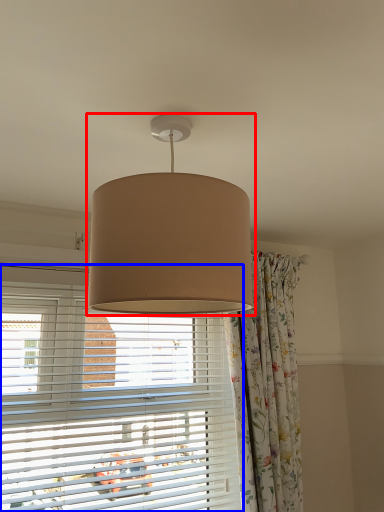
Question: Which of the following is the closest to the observer, lamp (highlighted by a red box) or window blind (highlighted by a blue box)?

Choices:
 (A) lamp
 (B) window blind

Answer: (A)